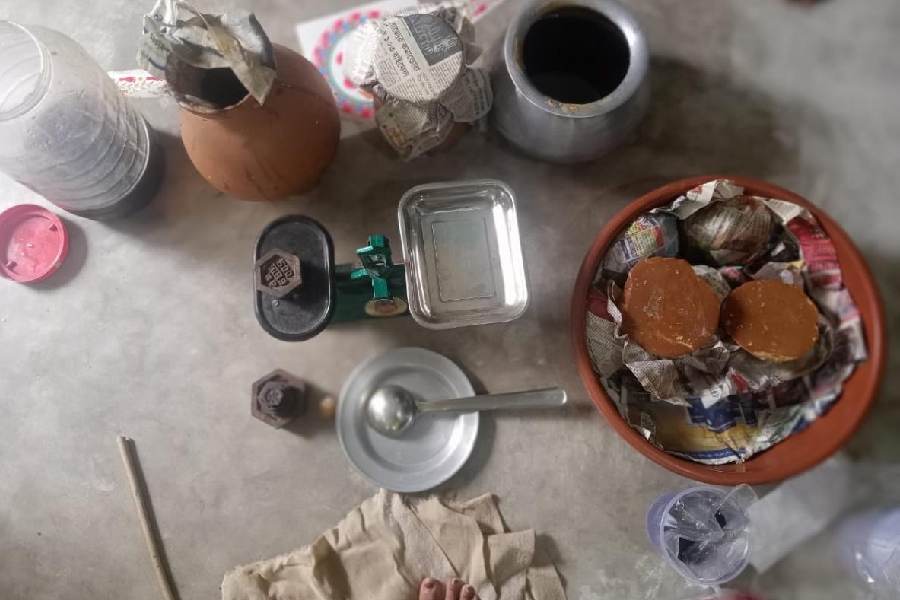
Identify the location of white small plate. Image resolution: width=900 pixels, height=600 pixels. (421, 465).